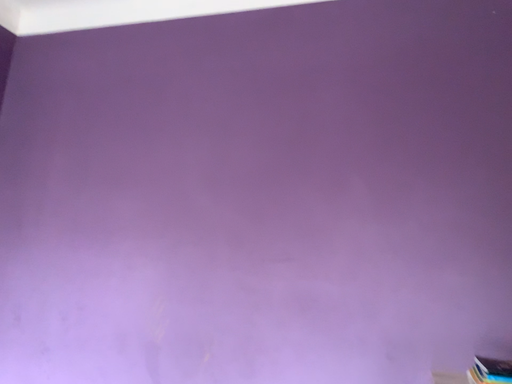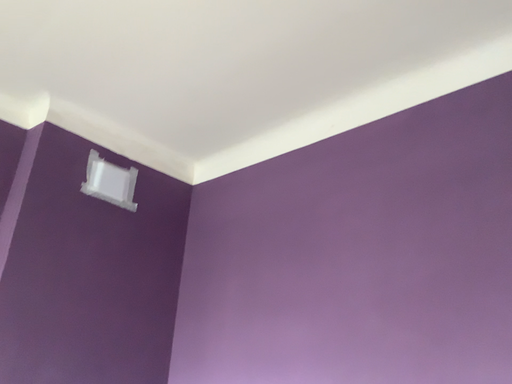
Question: How did the camera likely rotate when shooting the video?

Choices:
 (A) rotated upward
 (B) rotated downward

Answer: (A)